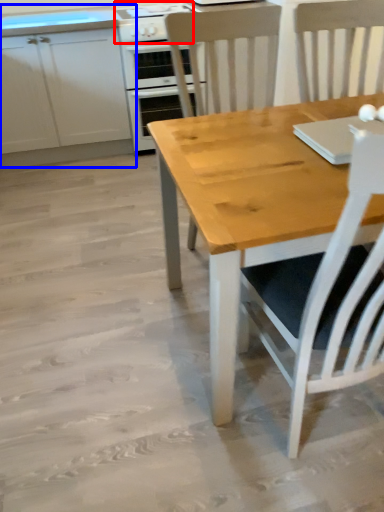
Question: Which object is further to the camera taking this photo, gas stove (highlighted by a red box) or cabinetry (highlighted by a blue box)?

Choices:
 (A) gas stove
 (B) cabinetry

Answer: (A)